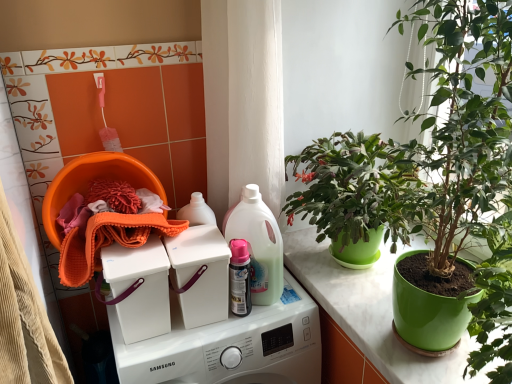
Locate an element on the screen. free point to the right of pink glossy spray can at center is located at coordinates (278, 305).